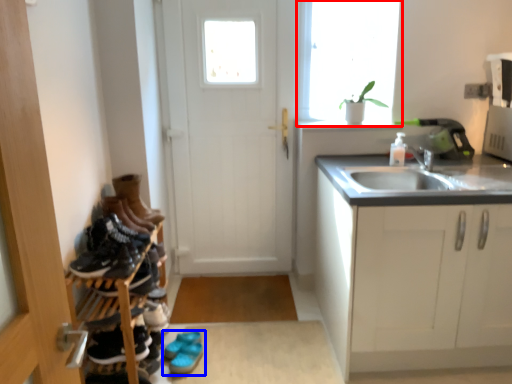
Question: Among these objects, which one is nearest to the camera, window (highlighted by a red box) or footwear (highlighted by a blue box)?

Choices:
 (A) window
 (B) footwear

Answer: (B)